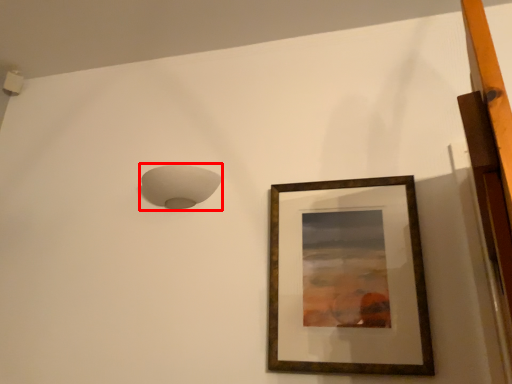
Question: Where is lamp (annotated by the red box) located in relation to picture frame in the image?

Choices:
 (A) right
 (B) left

Answer: (B)